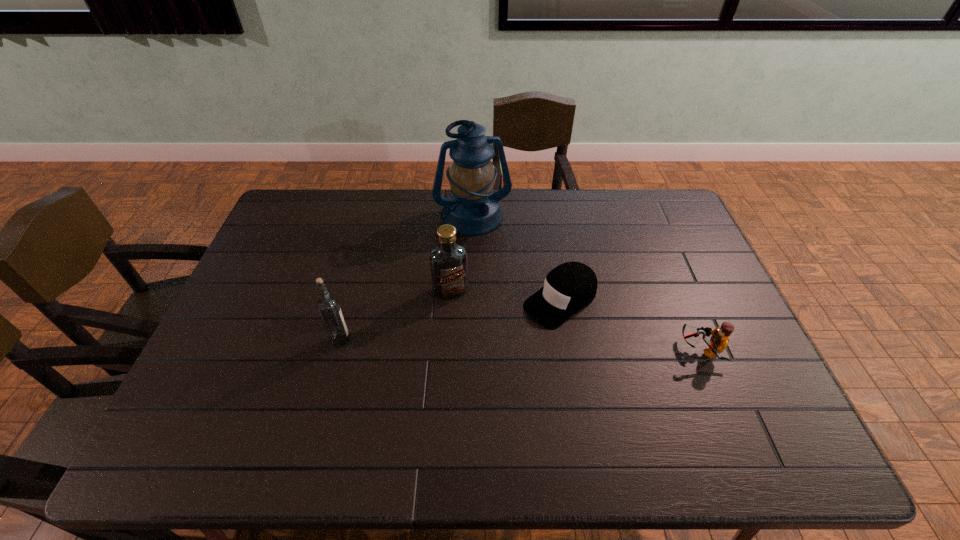
The image size is (960, 540). In order to click on vacant area that lies between the rightmost object and the left vodka in this screenshot , I will do `click(520, 345)`.

The height and width of the screenshot is (540, 960). I want to click on free space between the rightmost object and the right vodka, so click(x=575, y=320).

The image size is (960, 540). I want to click on the third closest object to the shortest object, so click(719, 340).

At what (x,y) coordinates should I click in order to perform the action: click on the closest object to the rightmost object. Please return your answer as a coordinate pair (x, y). Looking at the image, I should click on (571, 286).

Locate an element on the screen. vacant region that satisfies the following two spatial constraints: 1. on the front side of the rightmost object; 2. holding a crossbow in the hands of the shortest object is located at coordinates (568, 349).

The width and height of the screenshot is (960, 540). In order to click on free location that satisfies the following two spatial constraints: 1. on the front side of the rightmost object; 2. holding a crossbow in the hands of the fourth object from left to right in this screenshot , I will do `click(568, 349)`.